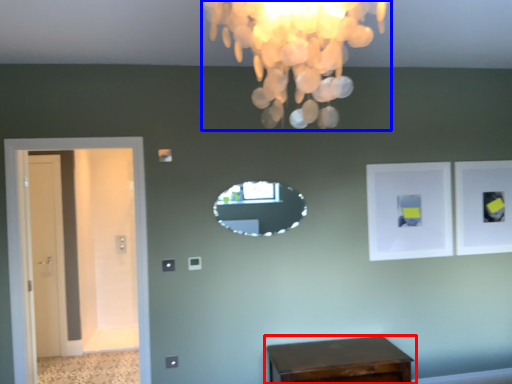
Question: Which point is closer to the camera, table (highlighted by a red box) or lamp (highlighted by a blue box)?

Choices:
 (A) table
 (B) lamp

Answer: (B)